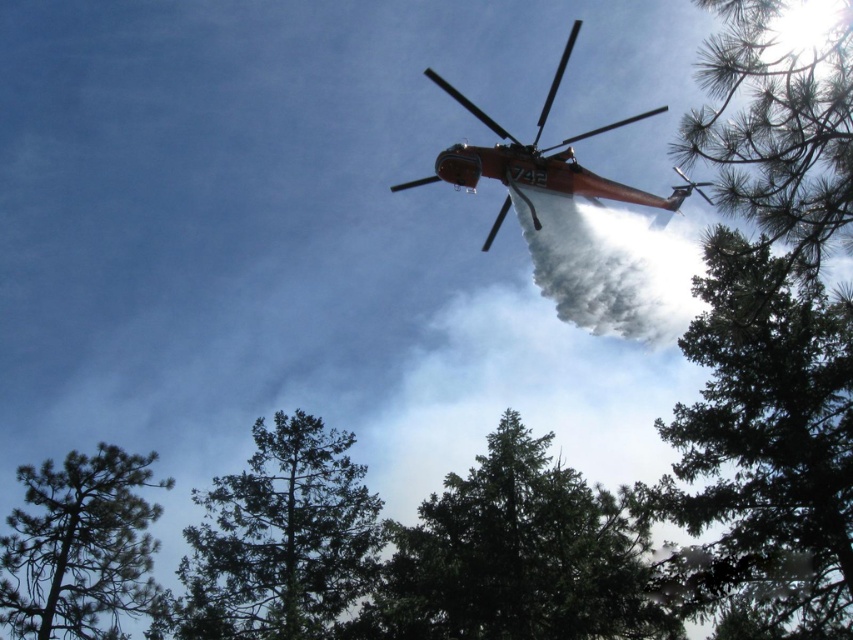
Between green textured tree at center and metallic orange helicopter at upper center, which one appears on the left side from the viewer's perspective?

Positioned to the left is green textured tree at center.

From the picture: Between green textured tree at center and metallic orange helicopter at upper center, which one is positioned lower?

Positioned lower is green textured tree at center.

Does point (357, 481) come farther from viewer compared to point (509, 184)?

Yes, point (357, 481) is farther from viewer.

Find the location of a particular element. The image size is (853, 640). green textured tree at center is located at coordinates (280, 538).

Is dark green textured tree at center smaller than metallic orange helicopter at upper center?

Correct, dark green textured tree at center occupies less space than metallic orange helicopter at upper center.

Between dark green textured tree at center and metallic orange helicopter at upper center, which one has less height?

With less height is dark green textured tree at center.

Where is `dark green textured tree at center`? The height and width of the screenshot is (640, 853). dark green textured tree at center is located at coordinates (515, 557).

At what (x,y) coordinates should I click in order to perform the action: click on dark green textured tree at center. Please return your answer as a coordinate pair (x, y). This screenshot has height=640, width=853. Looking at the image, I should click on (515, 557).

Does dark green textured tree at center have a greater width compared to green textured tree at center?

Correct, the width of dark green textured tree at center exceeds that of green textured tree at center.

Can you confirm if dark green textured tree at center is positioned to the right of green textured tree at center?

Indeed, dark green textured tree at center is positioned on the right side of green textured tree at center.

Is point (614, 522) less distant than point (306, 552)?

Yes, it is.

You are a GUI agent. You are given a task and a screenshot of the screen. Output one action in this format:
    pyautogui.click(x=<x>, y=<y>)
    Task: Click on the dark green textured tree at center
    
    Given the screenshot: What is the action you would take?
    pyautogui.click(x=515, y=557)